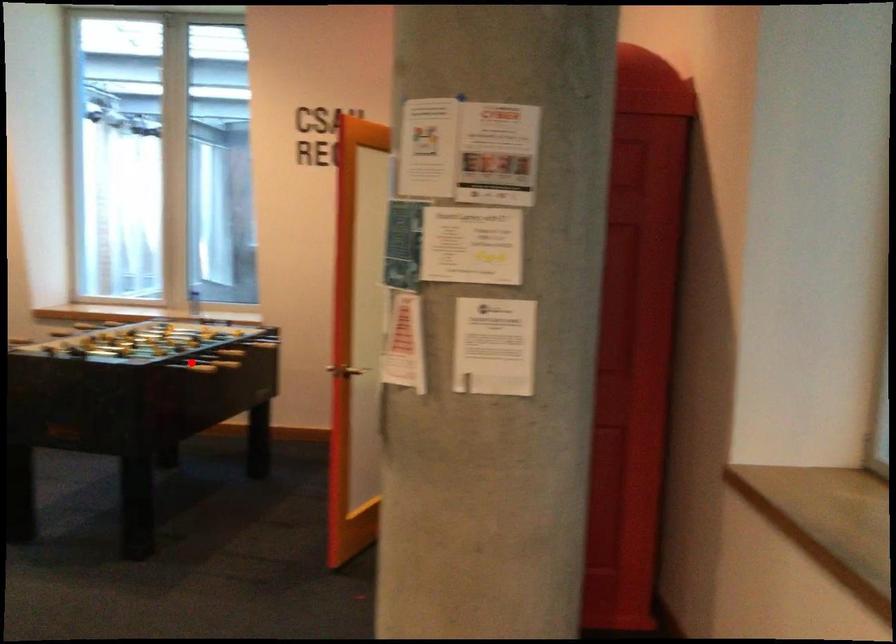
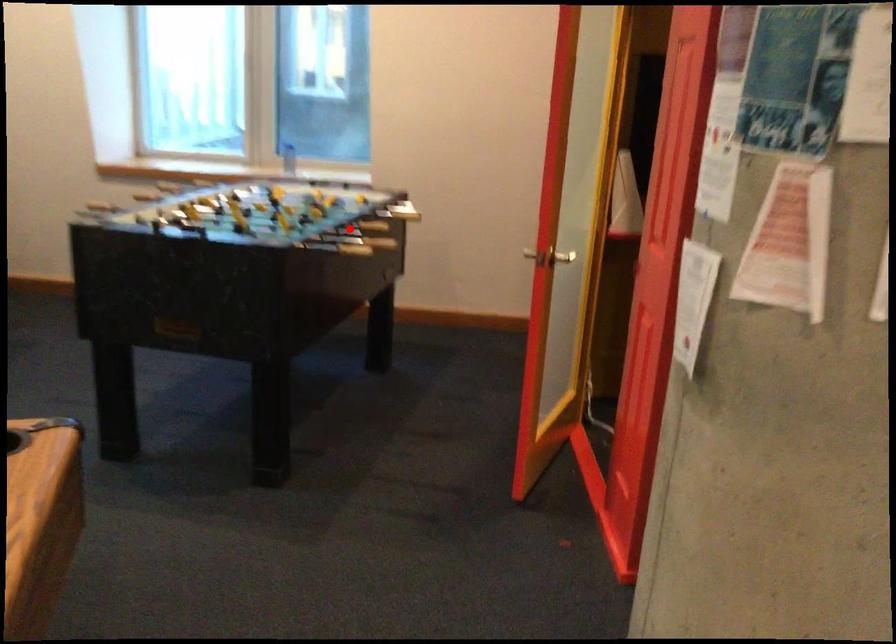
I am providing you with two images of the same scene from different viewpoints. A red point is marked on the first image and another point is marked on the second image. Does the point marked in image1 correspond to the same location as the one in image2?

No